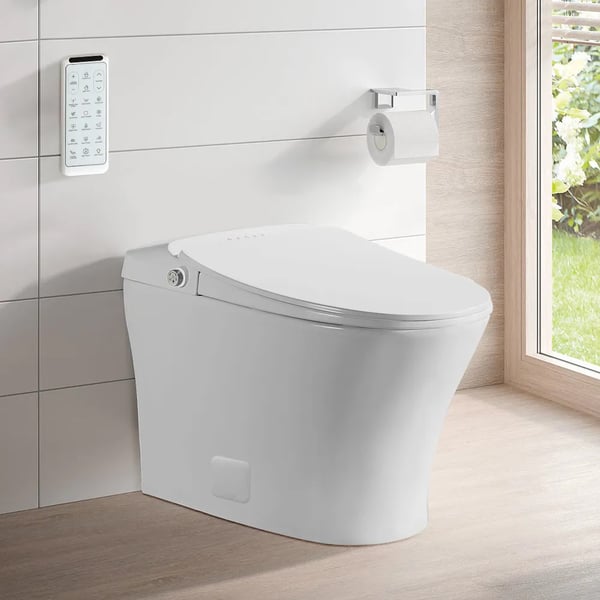
Identify the location of glass. (580, 250).